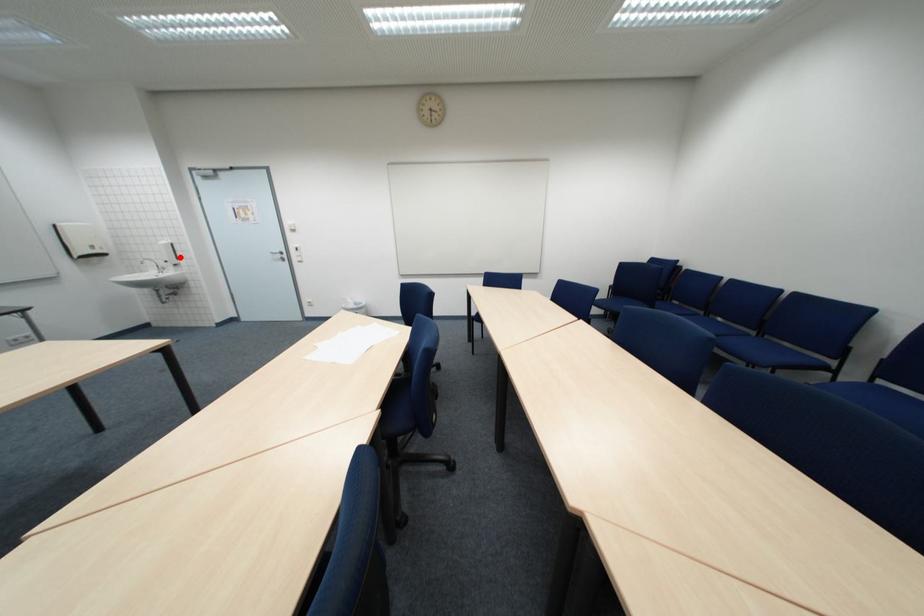
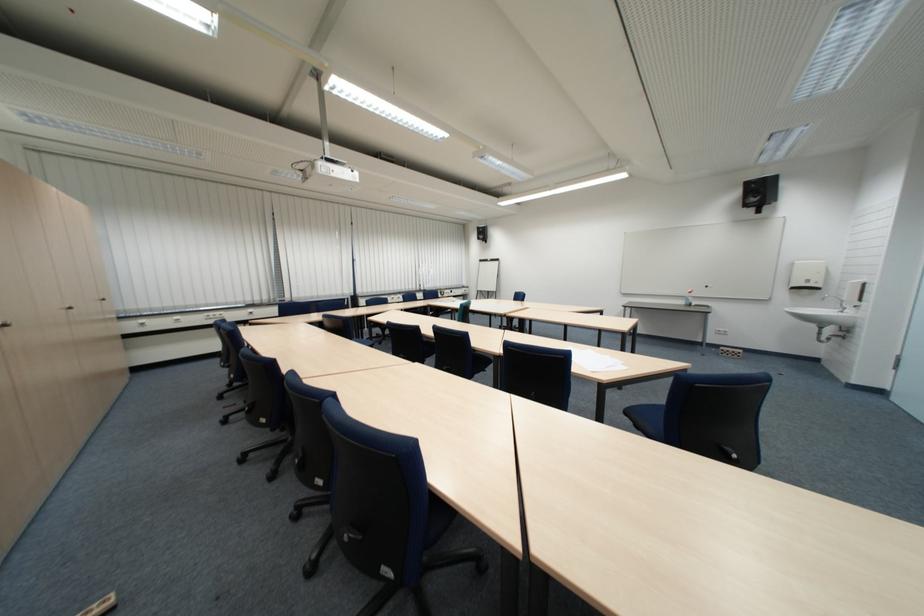
Find the pixel in the second image that matches the highlighted location in the first image.

(860, 296)